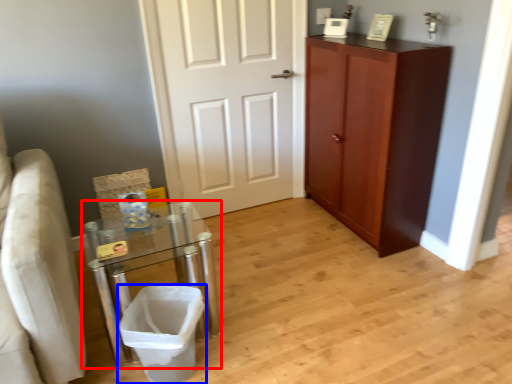
Question: Which of the following is the farthest to the observer, table (highlighted by a red box) or laundry basket (highlighted by a blue box)?

Choices:
 (A) table
 (B) laundry basket

Answer: (A)